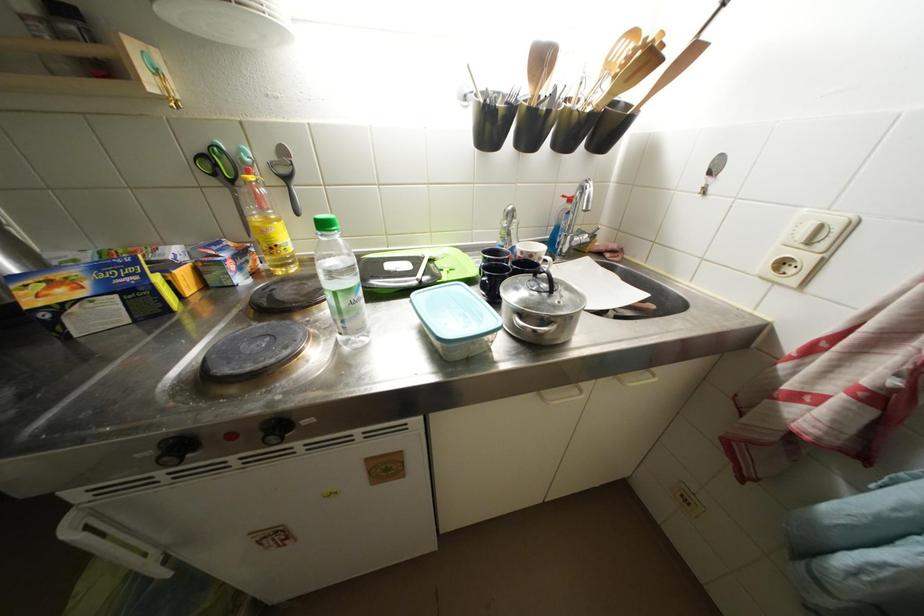
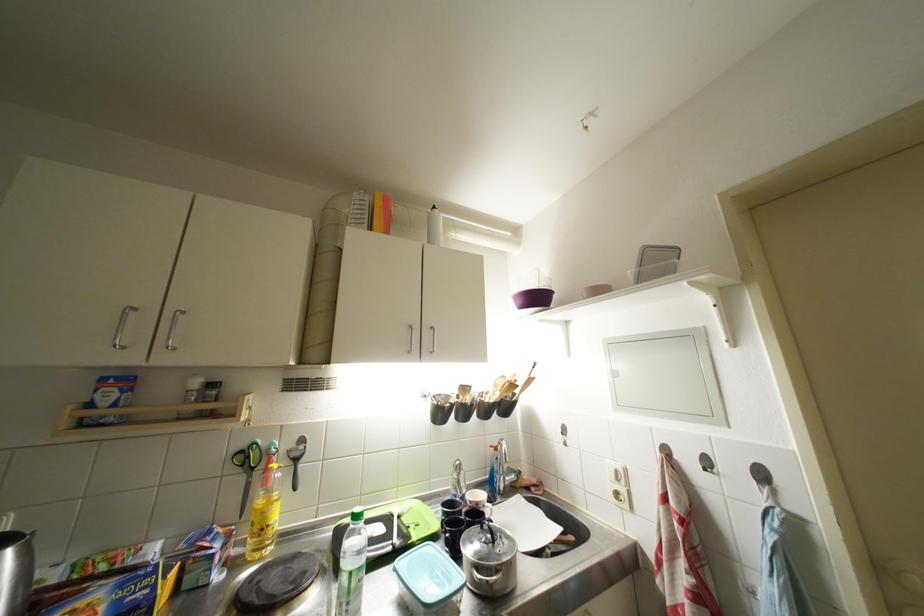
The point at (515, 238) is marked in the first image. Where is the corresponding point in the second image?

(466, 487)